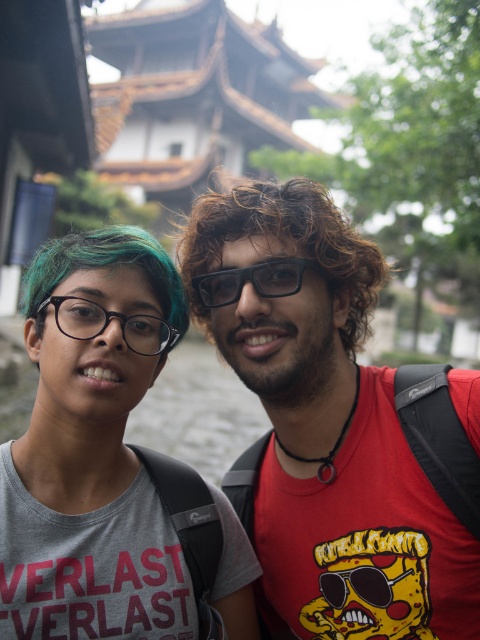
You are a photographer trying to capture a photo of both the person on the left and the person on the right. You notice two points marked in the scene. The first point is at coordinates point (71,253) and the second point is at coordinates point (228,276). Based on their positions, which point is closer to the camera and should be focused on to ensure both subjects are in sharp focus?

Point (71,253) is in front of point (228,276), so focusing on the closer point will help keep both subjects in focus.

Consider the image. You are a photographer trying to capture both the matte black glasses at left and the black matte glasses at center in a single frame. Given their sizes, which glasses will appear smaller in the photo?

The matte black glasses at left will appear smaller in the photo because their width is less than the black matte glasses at center.

Based on the scene description, can you determine if the teal glossy hair at center is positioned higher than the black matte glasses at center?

Yes, the teal glossy hair at center is above the black matte glasses at center, so it is positioned higher.